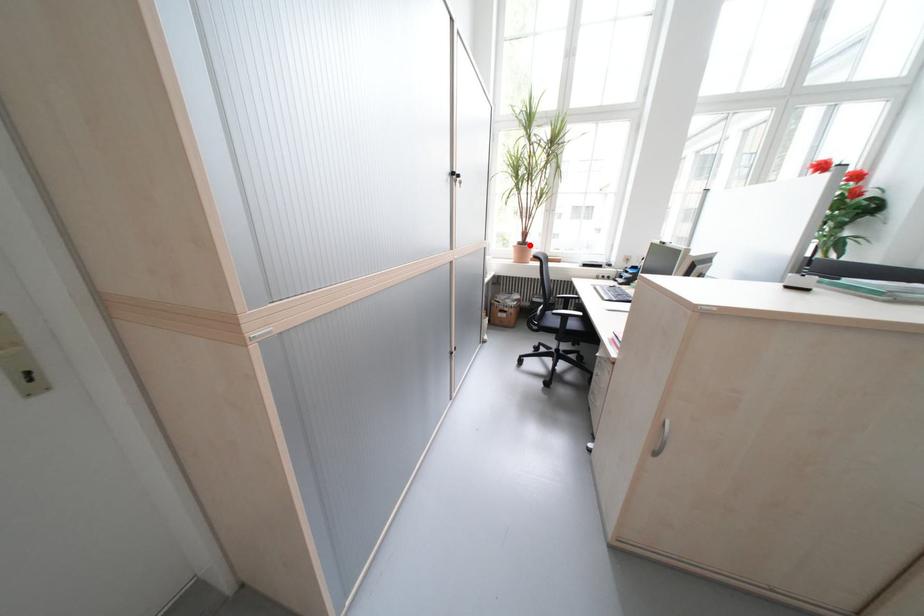
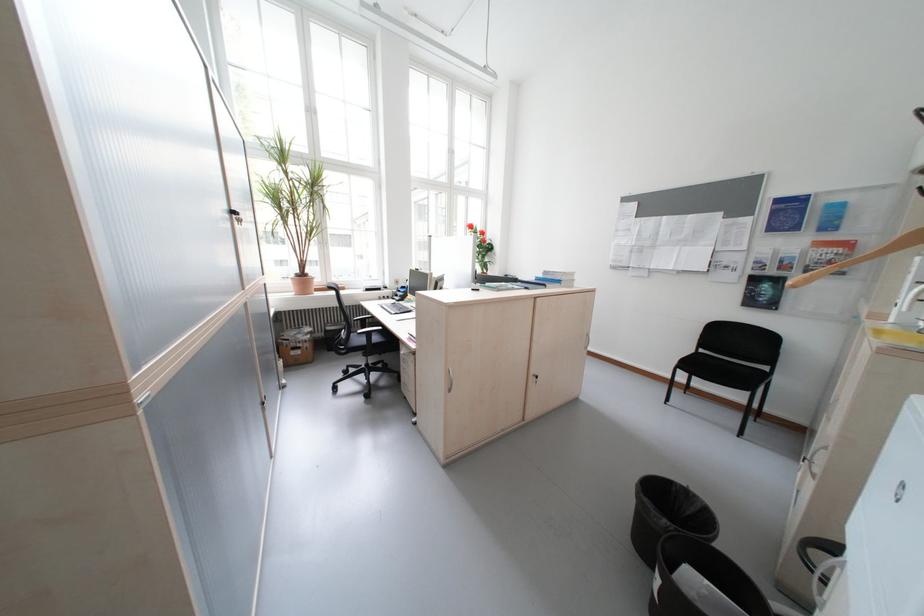
Question: I am providing you with two images of the same scene from different viewpoints. Given a red point in image1, look at the same physical point in image2. Is it:

Choices:
 (A) Closer to the viewpoint
 (B) Farther from the viewpoint

Answer: (B)